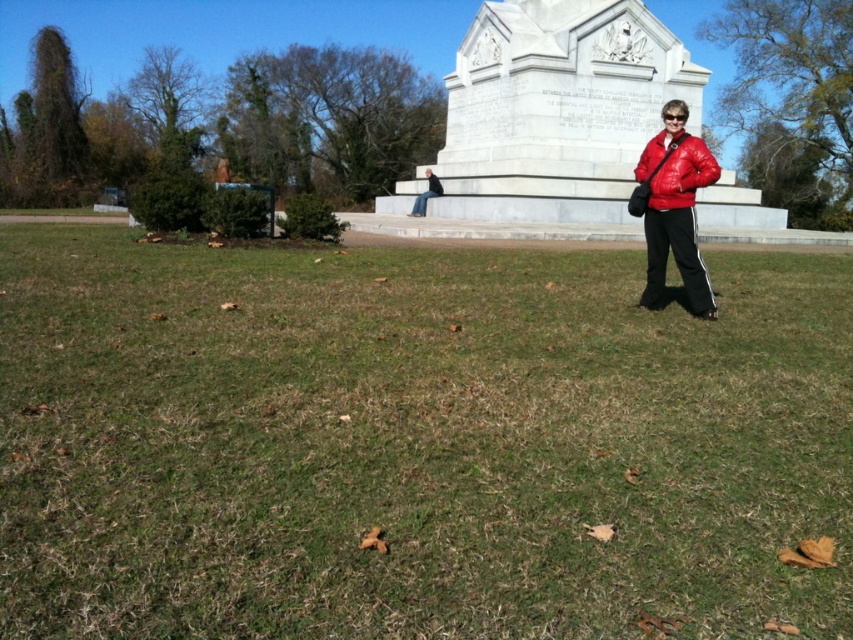
You are a photographer standing at the base of the monument. You want to take a photo that includes both the person in the matte red jacket at right and the seated person on the monument steps. Based on their positions, where should you position yourself to capture both in the frame?

To capture both the matte red jacket at right and the seated person on the monument steps in the frame, position yourself at the base of the monument facing towards the monument. Since the matte red jacket at right is located at point (672,209), this placement ensures both subjects are within the camera view.

You are a photographer trying to capture both the matte red jacket at center and the dark blue jeans at center in a single frame. Based on their heights, which one should you focus on first to ensure both are in the shot?

The matte red jacket at center is not as tall as dark blue jeans at center, so you should focus on the dark blue jeans at center first to ensure both are in the shot.